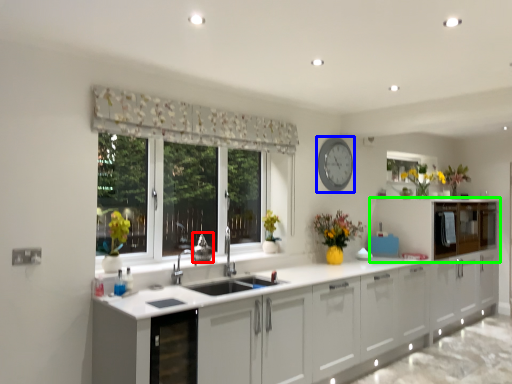
Question: Which object is the closest to the appliance (highlighted by a red box)? Choose among these: clock (highlighted by a blue box) or cabinetry (highlighted by a green box).

Choices:
 (A) clock
 (B) cabinetry

Answer: (A)